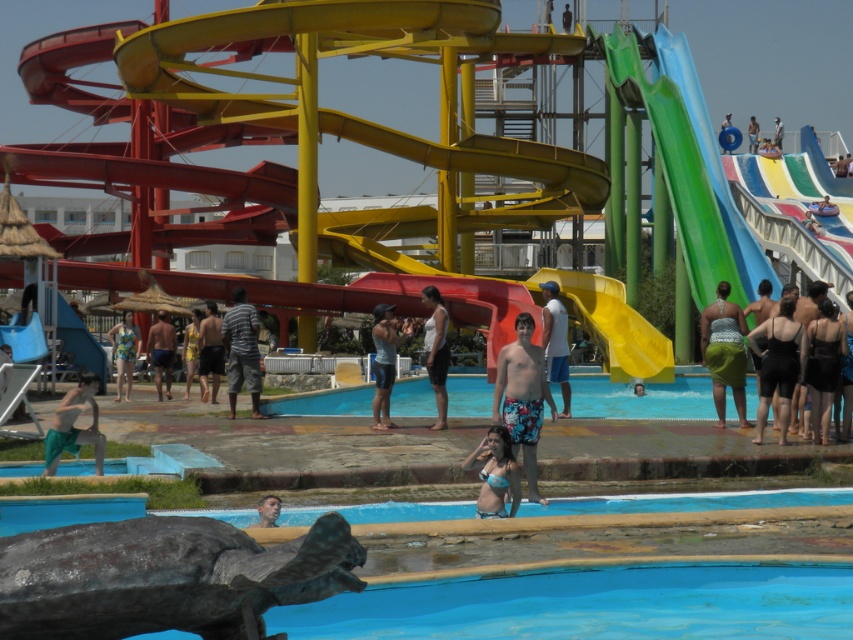
Can you confirm if yellow rubber slide at center is thinner than blue swim trunks at center?

Incorrect, yellow rubber slide at center's width is not less than blue swim trunks at center's.

Which is below, yellow rubber slide at center or blue swim trunks at center?

Positioned lower is blue swim trunks at center.

At what (x,y) coordinates should I click in order to perform the action: click on yellow rubber slide at center. Please return your answer as a coordinate pair (x, y). The image size is (853, 640). Looking at the image, I should click on (613, 324).

Does point (161, 339) lie behind point (186, 388)?

Yes, it is.

Measure the distance between blue swim trunks at center and camera.

blue swim trunks at center and camera are 72.99 meters apart from each other.

Locate an element on the screen. This screenshot has height=640, width=853. blue swim trunks at center is located at coordinates (161, 352).

Who is positioned more to the right, blue smooth pool at lower center or yellow fabric shorts at center?

From the viewer's perspective, blue smooth pool at lower center appears more on the right side.

Which of these two, blue smooth pool at lower center or yellow fabric shorts at center, stands taller?

yellow fabric shorts at center

Find the location of a particular element. The height and width of the screenshot is (640, 853). blue smooth pool at lower center is located at coordinates (593, 602).